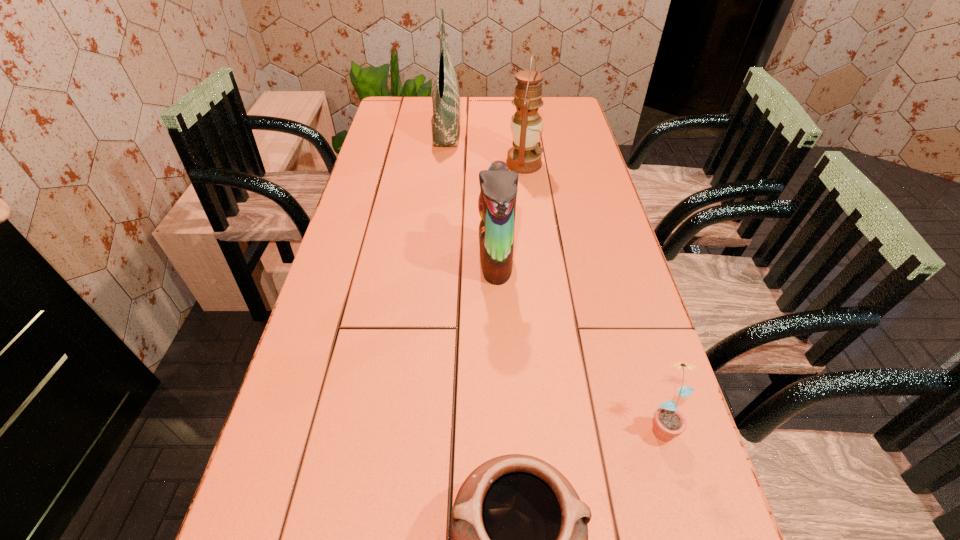
Image resolution: width=960 pixels, height=540 pixels. Find the location of `free point located at the face of the parrot`. free point located at the face of the parrot is located at coordinates pos(415,260).

At what (x,y) coordinates should I click in order to perform the action: click on free region located on the flower of the rightmost object. Please return your answer as a coordinate pair (x, y). Image resolution: width=960 pixels, height=540 pixels. Looking at the image, I should click on (689, 522).

The height and width of the screenshot is (540, 960). I want to click on object positioned at the far edge, so click(445, 93).

Find the location of a particular element. The image size is (960, 540). object at the right edge is located at coordinates (669, 422).

Where is `vacant space at the far edge of the desktop`? This screenshot has height=540, width=960. vacant space at the far edge of the desktop is located at coordinates (505, 104).

Where is `free space at the left edge of the desktop`? free space at the left edge of the desktop is located at coordinates (398, 228).

What are the coordinates of `vacant space at the right edge of the desktop` in the screenshot? It's located at (578, 245).

The width and height of the screenshot is (960, 540). I want to click on free space at the far right corner, so click(563, 102).

Find the location of a particular element. free point between the second nearest object and the leftmost object is located at coordinates (553, 275).

Locate an element on the screen. the fourth closest object to the pottery is located at coordinates (445, 93).